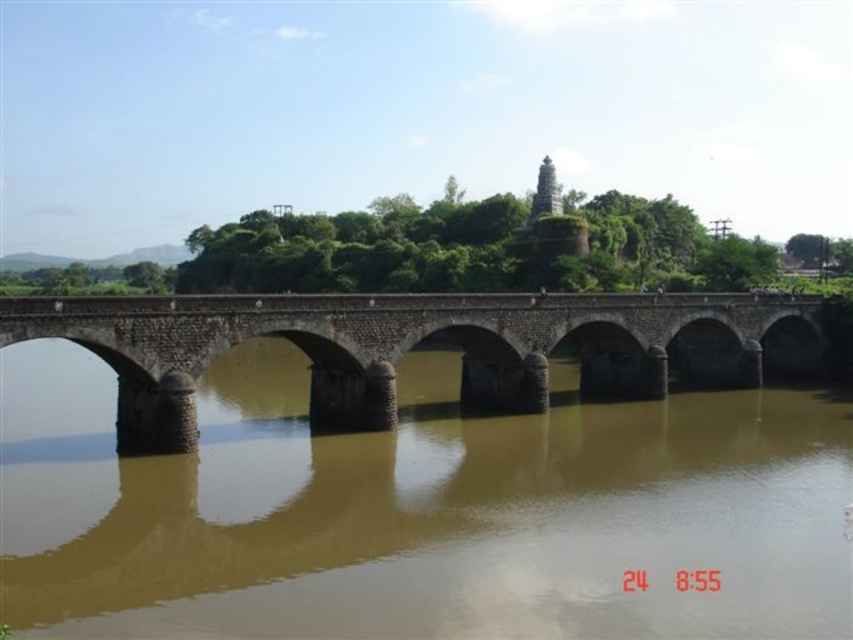
You are standing on the bank of the brown stone river at center and want to cross to the other side. Can you step onto the brown stone bridge at center from where you are standing?

The brown stone river at center is closer to the viewer than the brown stone bridge at center, so you cannot step onto the brown stone bridge at center from the bank of the brown stone river at center because the river is in front of the bridge and you would need to cross it first.

You are standing at the coordinates point 0.5, 0.5 in the image. Which direction should you move to reach the brown stone river at center?

The brown stone river at center is located at point (418, 509). Since you are at (426, 320), you should move towards the right to reach it because the river is positioned to the east relative to your current position.

You are a hiker standing on the brown stone bridge at center. Looking down, you notice the brown stone river at center. Which direction is the river flowing relative to the bridge?

The brown stone river at center is located below the brown stone bridge at center, so the river flows beneath the bridge. However, the direction of the river flow cannot be determined from the given information.